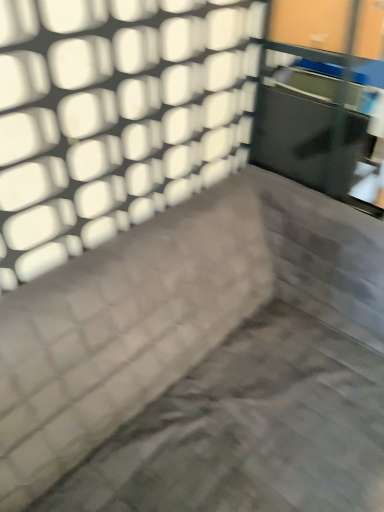
The image size is (384, 512). Describe the element at coordinates (204, 362) in the screenshot. I see `dark gray fabric couch at center` at that location.

Locate an element on the screen. dark gray fabric couch at center is located at coordinates (204, 362).

This screenshot has width=384, height=512. What do you see at coordinates (320, 94) in the screenshot?
I see `transparent glass door at upper right` at bounding box center [320, 94].

Where is `transparent glass door at upper right`? transparent glass door at upper right is located at coordinates (320, 94).

Where is `dark gray fabric couch at center`? The width and height of the screenshot is (384, 512). dark gray fabric couch at center is located at coordinates (204, 362).

Between dark gray fabric couch at center and transparent glass door at upper right, which one appears on the right side from the viewer's perspective?

Positioned to the right is transparent glass door at upper right.

Is dark gray fabric couch at center further to camera compared to transparent glass door at upper right?

No, it is in front of transparent glass door at upper right.

Which is closer to the camera, (126, 239) or (383, 154)?

Point (126, 239) appears to be closer to the viewer than point (383, 154).

From the picture: From the image's perspective, would you say dark gray fabric couch at center is positioned over transparent glass door at upper right?

No, from the image's perspective, dark gray fabric couch at center is not above transparent glass door at upper right.

From a real-world perspective, is dark gray fabric couch at center positioned under transparent glass door at upper right based on gravity?

Yes, from a real-world perspective, dark gray fabric couch at center is beneath transparent glass door at upper right.

Considering the sizes of dark gray fabric couch at center and transparent glass door at upper right in the image, is dark gray fabric couch at center wider or thinner than transparent glass door at upper right?

Considering their sizes, dark gray fabric couch at center looks broader than transparent glass door at upper right.

Considering the sizes of objects dark gray fabric couch at center and transparent glass door at upper right in the image provided, who is shorter, dark gray fabric couch at center or transparent glass door at upper right?

Standing shorter between the two is transparent glass door at upper right.

Between dark gray fabric couch at center and transparent glass door at upper right, which one has larger size?

With larger size is dark gray fabric couch at center.

Is dark gray fabric couch at center positioned beyond the bounds of transparent glass door at upper right?

Yes.

Is dark gray fabric couch at center in contact with transparent glass door at upper right?

dark gray fabric couch at center and transparent glass door at upper right are clearly separated.

Is dark gray fabric couch at center oriented towards transparent glass door at upper right?

No, dark gray fabric couch at center is not turned towards transparent glass door at upper right.

Image resolution: width=384 pixels, height=512 pixels. Identify the location of furniture located below the transparent glass door at upper right (from the image's perspective). (204, 362).

Can you confirm if transparent glass door at upper right is positioned to the right of dark gray fabric couch at center?

Correct, you'll find transparent glass door at upper right to the right of dark gray fabric couch at center.

Which object is closer to the camera, transparent glass door at upper right or dark gray fabric couch at center?

dark gray fabric couch at center is more forward.

Is point (378, 42) positioned after point (271, 204)?

That is False.

From the image's perspective, is transparent glass door at upper right above or below dark gray fabric couch at center?

transparent glass door at upper right is above dark gray fabric couch at center.

From a real-world perspective, is transparent glass door at upper right on top of dark gray fabric couch at center?

Correct, in the physical world, transparent glass door at upper right is higher than dark gray fabric couch at center.

In the scene shown: In terms of width, does transparent glass door at upper right look wider or thinner when compared to dark gray fabric couch at center?

Clearly, transparent glass door at upper right has less width compared to dark gray fabric couch at center.

Does transparent glass door at upper right have a greater height compared to dark gray fabric couch at center?

No.

Can you confirm if transparent glass door at upper right is smaller than dark gray fabric couch at center?

Correct, transparent glass door at upper right occupies less space than dark gray fabric couch at center.

Can dark gray fabric couch at center be found inside transparent glass door at upper right?

No, dark gray fabric couch at center is located outside of transparent glass door at upper right.

Is transparent glass door at upper right in contact with dark gray fabric couch at center?

No.

Is transparent glass door at upper right oriented towards dark gray fabric couch at center?

No, transparent glass door at upper right is not oriented towards dark gray fabric couch at center.

How many degrees apart are the facing directions of transparent glass door at upper right and dark gray fabric couch at center?

transparent glass door at upper right and dark gray fabric couch at center are facing 0.0925 degrees away from each other.

Where is `glass door above the dark gray fabric couch at center (from a real-world perspective)`? glass door above the dark gray fabric couch at center (from a real-world perspective) is located at coordinates (320, 94).

Identify the location of glass door that is on the right side of dark gray fabric couch at center. Image resolution: width=384 pixels, height=512 pixels. (320, 94).

The height and width of the screenshot is (512, 384). Find the location of `furniture below the transparent glass door at upper right (from the image's perspective)`. furniture below the transparent glass door at upper right (from the image's perspective) is located at coordinates (204, 362).